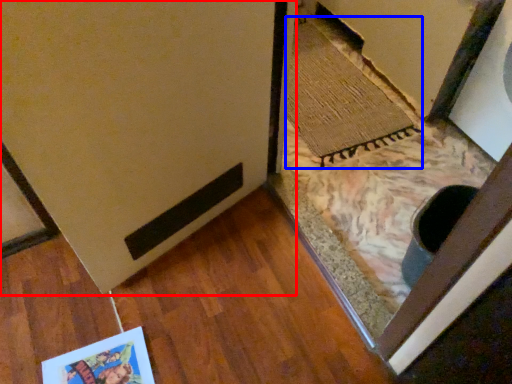
Question: Which of the following is the closest to the observer, door (highlighted by a red box) or doormat (highlighted by a blue box)?

Choices:
 (A) door
 (B) doormat

Answer: (A)